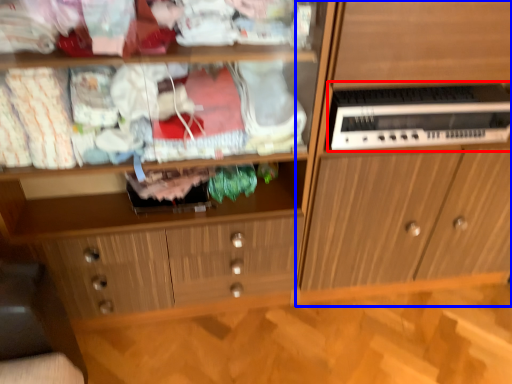
Question: Which of the following is the closest to the observer, home appliance (highlighted by a red box) or cabinetry (highlighted by a blue box)?

Choices:
 (A) home appliance
 (B) cabinetry

Answer: (B)